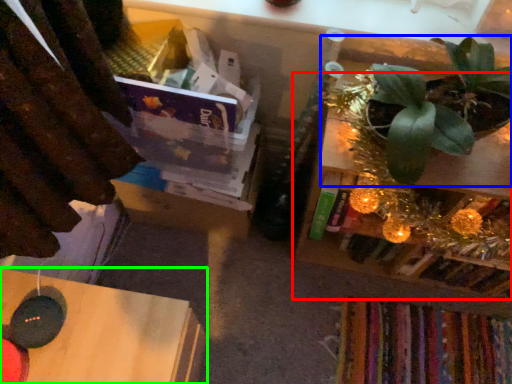
Question: Estimate the real-world distances between objects in this image. Which object is closer to shelf (highlighted by a red box), houseplant (highlighted by a blue box) or table (highlighted by a green box)?

Choices:
 (A) houseplant
 (B) table

Answer: (A)